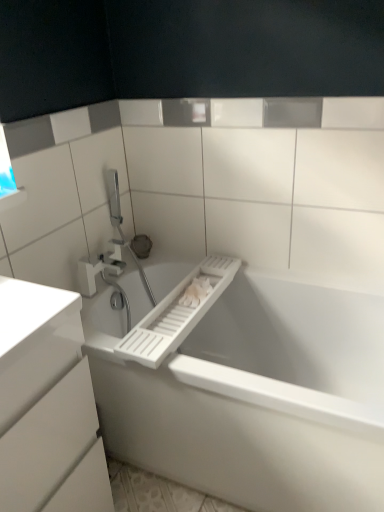
Question: Looking at their shapes, would you say white plastic towel bar at center is wider or thinner than white plastic bathtub at lower left?

Choices:
 (A) wide
 (B) thin

Answer: (B)

Question: Is point (172, 294) positioned closer to the camera than point (218, 415)?

Choices:
 (A) farther
 (B) closer

Answer: (A)

Question: Based on their relative distances, which object is farther from the white plastic bathtub at lower left?

Choices:
 (A) transparent glass window at upper left
 (B) white plastic tap at upper left
 (C) white glossy cabinet at lower left
 (D) white plastic towel bar at center

Answer: (A)

Question: Considering the real-world distances, which object is farthest from the transparent glass window at upper left?

Choices:
 (A) white plastic tap at upper left
 (B) white glossy cabinet at lower left
 (C) white plastic towel bar at center
 (D) white plastic bathtub at lower left

Answer: (D)